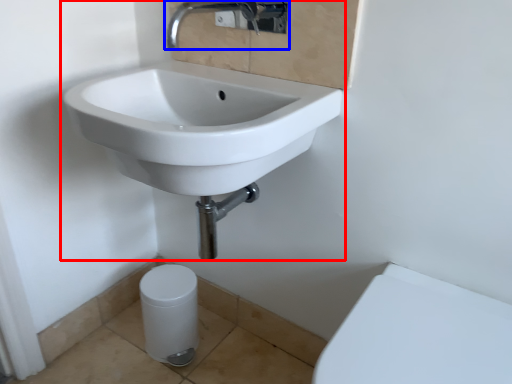
Question: Among these objects, which one is farthest to the camera, sink (highlighted by a red box) or tap (highlighted by a blue box)?

Choices:
 (A) sink
 (B) tap

Answer: (B)